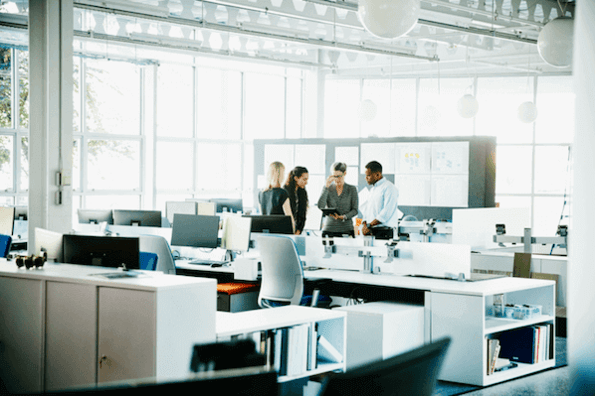
The width and height of the screenshot is (595, 396). What are the coordinates of `light` in the screenshot? It's located at (397, 24), (562, 54), (525, 115), (367, 108).